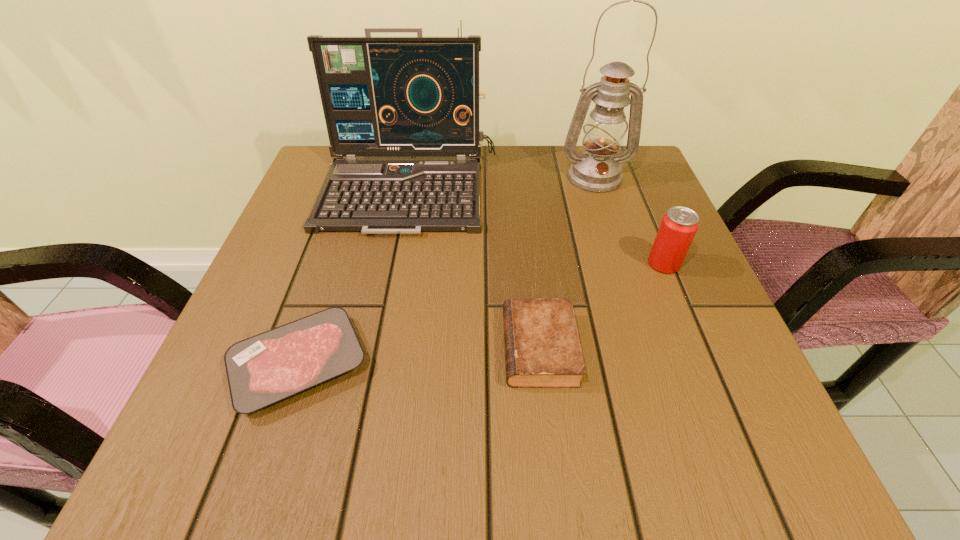
Locate an element on the screen. The height and width of the screenshot is (540, 960). can that is at the right edge is located at coordinates (679, 225).

This screenshot has width=960, height=540. I want to click on object located in the far left corner section of the desktop, so click(381, 96).

The width and height of the screenshot is (960, 540). I want to click on object located in the near left corner section of the desktop, so click(x=264, y=369).

The height and width of the screenshot is (540, 960). In order to click on object that is positioned at the far right corner in this screenshot , I will do `click(598, 170)`.

In the image, there is a desktop. Where is `vacant space at the far edge`? vacant space at the far edge is located at coordinates (497, 172).

Locate an element on the screen. vacant space at the near edge of the desktop is located at coordinates (499, 455).

Where is `vacant space at the left edge of the desktop`? This screenshot has width=960, height=540. vacant space at the left edge of the desktop is located at coordinates coord(295,234).

Identify the location of free space at the right edge. (693, 285).

Where is `free space at the far left corner`? free space at the far left corner is located at coordinates (325, 165).

At what (x,y) coordinates should I click in order to perform the action: click on empty location between the tallest object and the steak. Please return your answer as a coordinate pair (x, y). Image resolution: width=960 pixels, height=540 pixels. Looking at the image, I should click on (447, 271).